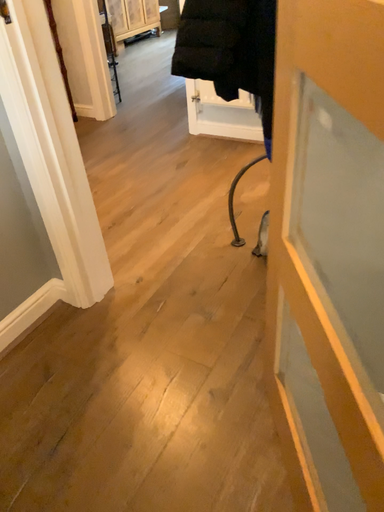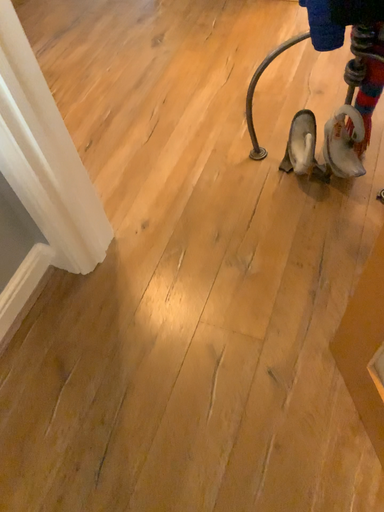
Question: Which way did the camera rotate in the video?

Choices:
 (A) rotated upward
 (B) rotated downward

Answer: (B)